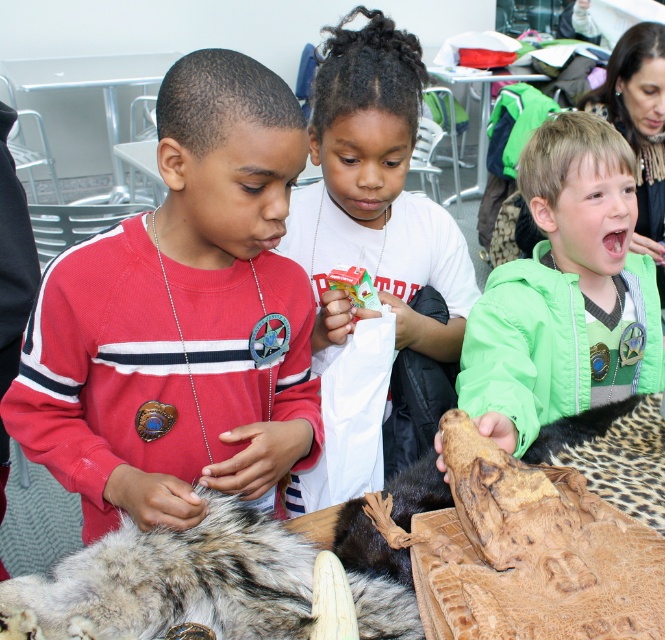
You are standing in the classroom and need to place a small object into the white matte paper bag at center. Where should you aim to place it?

The white matte paper bag at center is located at point (374,196), so you should aim for that coordinate to place the small object into it.

You are a teacher in a classroom where students are working with specimens. You need to retrieve the fuzzy fur pelt at lower left for a demonstration. Is it possible to reach it without moving the white matte paper bag at center?

The fuzzy fur pelt at lower left is behind the white matte paper bag at center, so you can reach it without moving the white matte paper bag at center because it is accessible from behind.

You are standing 1.18 meters away from the point at coordinates [203,307]. If you take two steps forward, will you be closer to or farther from the point?

The point at coordinates [203,307] is 1.18 meters away from you. If you take two steps forward, you will be closer to the point.